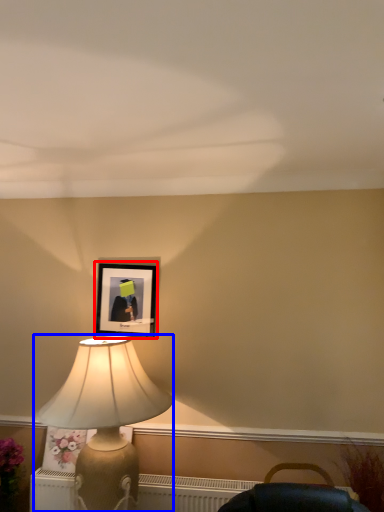
Question: Which of the following is the closest to the observer, picture frame (highlighted by a red box) or lamp (highlighted by a blue box)?

Choices:
 (A) picture frame
 (B) lamp

Answer: (B)